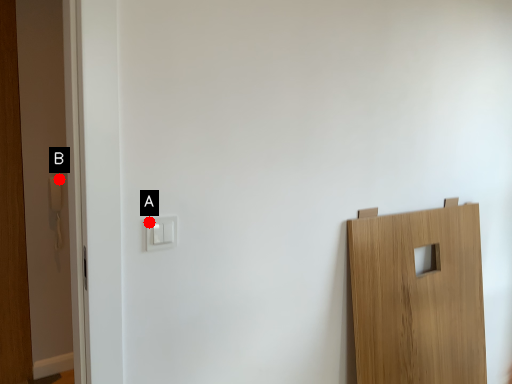
Question: Two points are circled on the image, labeled by A and B beside each circle. Which point is closer to the camera taking this photo?

Choices:
 (A) A is closer
 (B) B is closer

Answer: (A)